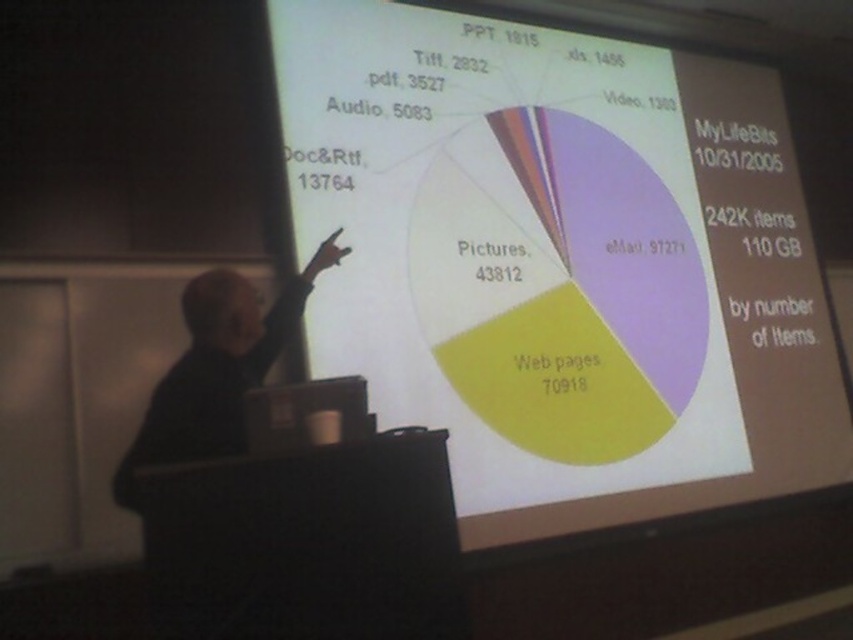
Consider the image. You are organizing a presentation and need to place a white paper at center and a black fabric at left on a table. If the table is only 1 meter wide, will both items fit side by side?

The white paper at center is larger than the black fabric at left. However, since the table is 1 meter wide, we need to know their exact dimensions to determine if they can fit together. The provided information only states the relative size between them, not their actual measurements.

You are organizing a presentation and need to place a white paper at center and a black fabric at left on a table. If the table has limited space, which item should you prioritize placing first to ensure both fit?

The black fabric at left should be placed first since it is narrower than the white paper at center, allowing more space for the wider item afterward.

You are sitting in the audience of the presentation and want to look at both the white paper at center and the black fabric at left. Which object will you see first when you look from your seat?

The white paper at center is further to the viewer than the black fabric at left, so you will see the white paper at center first.